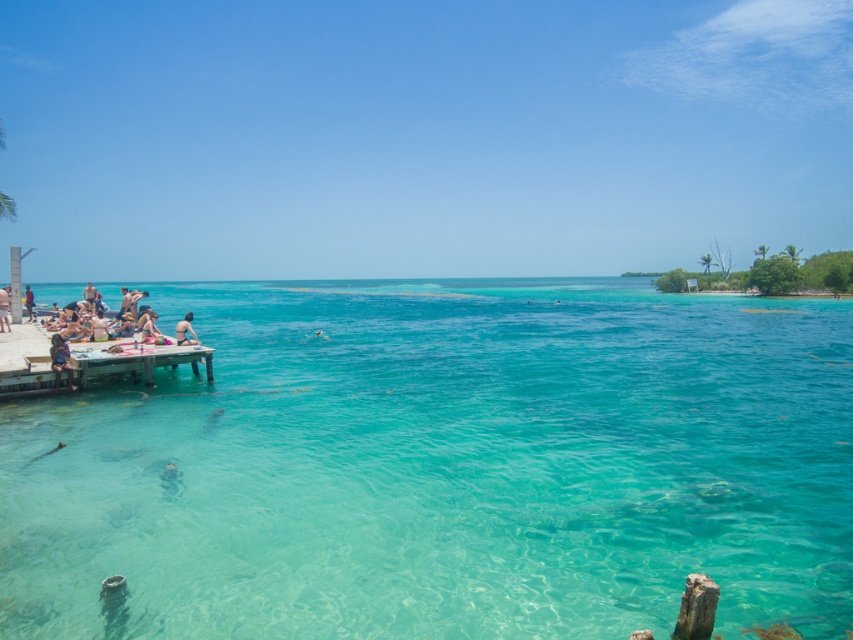
You are standing on the beach and want to reach the wooden dock at lower left. The maximum distance you can walk is 20 meters. Can you reach it without swimming?

The wooden dock at lower left is 17.07 meters away from the viewer, so yes, you can reach it by walking since it is within your 20 meters limit.

You are a photographer planning to capture a wide shot of the beach scene. You want to ensure both the wooden dock at lower left and the tan skin person at left are clearly visible in the frame. Considering their sizes, which object should you focus on to ensure both are in focus?

The wooden dock at lower left is bigger than the tan skin person at left. To ensure both are in focus, focus on the wooden dock at lower left since it is larger and will help maintain depth of field for the smaller tan skin person at left.